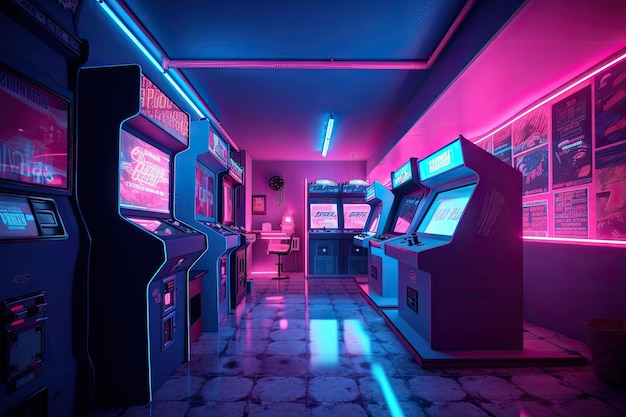
You are a GUI agent. You are given a task and a screenshot of the screen. Output one action in this format:
    pyautogui.click(x=<x>, y=<y>)
    Task: Click on the work chair
    
    Given the screenshot: What is the action you would take?
    pyautogui.click(x=282, y=248)